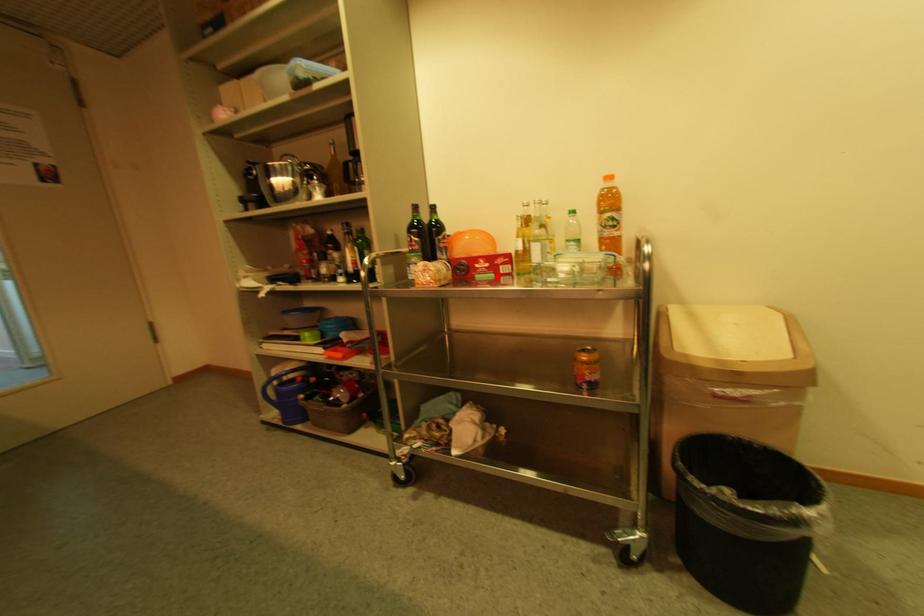
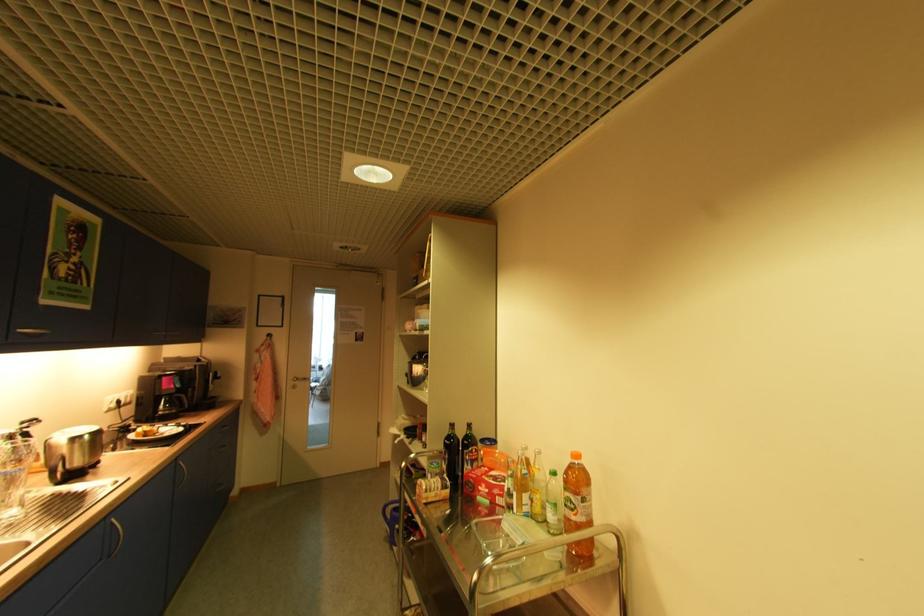
Question: A red point is marked in image1. In image2, is the corresponding 3D point closer to the camera or farther? Reply with the corresponding letter.

Choices:
 (A) The corresponding 3D point is closer.
 (B) The corresponding 3D point is farther.

Answer: (B)